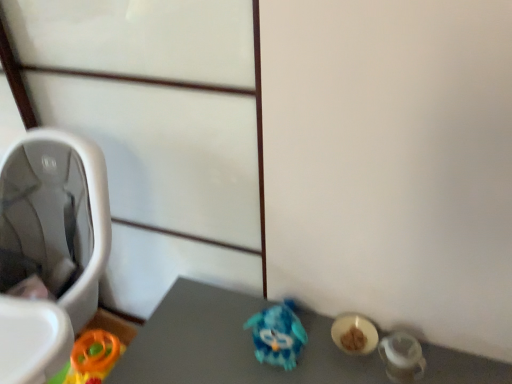
The image size is (512, 384). Find the location of `free space above blue shiny toy at center (from a real-world perspective)`. free space above blue shiny toy at center (from a real-world perspective) is located at coordinates (266, 360).